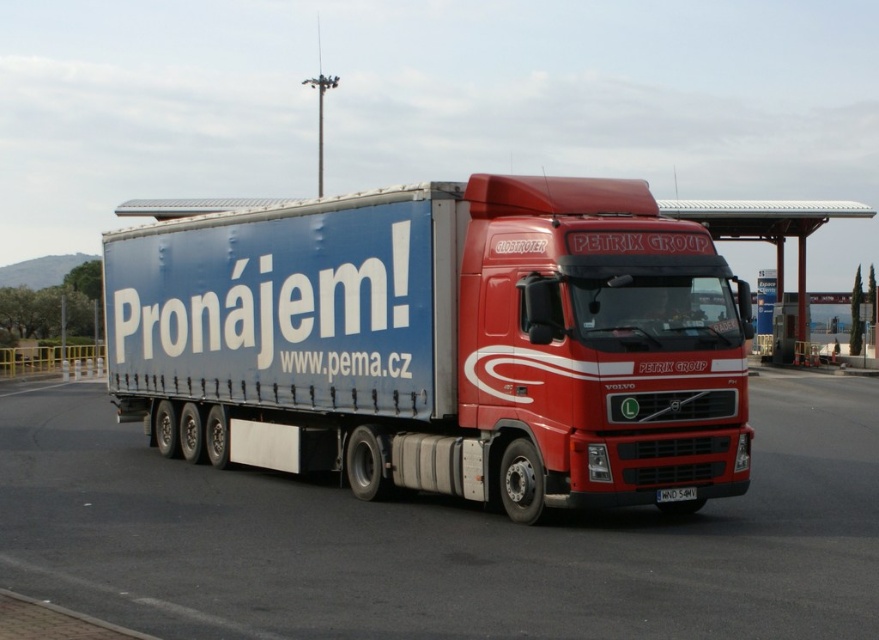
From the picture: Does matte blue trailer at center appear on the left side of red matte truck at center?

Indeed, matte blue trailer at center is positioned on the left side of red matte truck at center.

The height and width of the screenshot is (640, 879). I want to click on matte blue trailer at center, so click(x=441, y=342).

Identify the location of matte blue trailer at center. (441, 342).

Does point (798, 593) come closer to viewer compared to point (656, 490)?

Yes, point (798, 593) is closer to viewer.

Who is positioned more to the right, red matte truck at center or white plastic license plate at bottom center?

white plastic license plate at bottom center

This screenshot has width=879, height=640. Describe the element at coordinates (440, 540) in the screenshot. I see `red matte truck at center` at that location.

Locate an element on the screen. red matte truck at center is located at coordinates (440, 540).

Which of these two, matte blue trailer at center or white plastic license plate at bottom center, stands taller?

Standing taller between the two is matte blue trailer at center.

Does matte blue trailer at center have a smaller size compared to white plastic license plate at bottom center?

Incorrect, matte blue trailer at center is not smaller in size than white plastic license plate at bottom center.

Which is in front, point (549, 275) or point (684, 490)?

Point (549, 275)

Where is `matte blue trailer at center`? The height and width of the screenshot is (640, 879). matte blue trailer at center is located at coordinates (441, 342).